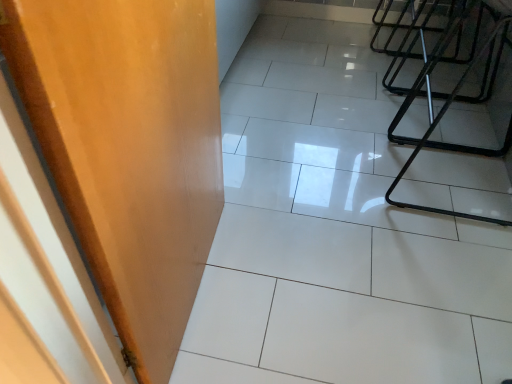
Question: Is wooden door at left at the back of white glossy tile at center?

Choices:
 (A) yes
 (B) no

Answer: (B)

Question: From the image's perspective, is white glossy tile at center located beneath wooden door at left?

Choices:
 (A) no
 (B) yes

Answer: (A)

Question: Does white glossy tile at center appear on the right side of wooden door at left?

Choices:
 (A) no
 (B) yes

Answer: (B)

Question: From a real-world perspective, is white glossy tile at center under wooden door at left?

Choices:
 (A) yes
 (B) no

Answer: (A)

Question: Can you confirm if white glossy tile at center is smaller than wooden door at left?

Choices:
 (A) yes
 (B) no

Answer: (B)

Question: Does white glossy tile at center have a lesser height compared to wooden door at left?

Choices:
 (A) yes
 (B) no

Answer: (A)

Question: Is wooden door at left far away from white glossy tile at center?

Choices:
 (A) no
 (B) yes

Answer: (A)

Question: Does wooden door at left have a lesser width compared to white glossy tile at center?

Choices:
 (A) yes
 (B) no

Answer: (A)

Question: From the image's perspective, is wooden door at left located beneath white glossy tile at center?

Choices:
 (A) no
 (B) yes

Answer: (B)

Question: From a real-world perspective, is wooden door at left on white glossy tile at center?

Choices:
 (A) no
 (B) yes

Answer: (B)

Question: Does wooden door at left have a larger size compared to white glossy tile at center?

Choices:
 (A) no
 (B) yes

Answer: (A)

Question: Is wooden door at left at the left side of white glossy tile at center?

Choices:
 (A) yes
 (B) no

Answer: (A)

Question: From a real-world perspective, is white glossy tile at center above or below wooden door at left?

Choices:
 (A) below
 (B) above

Answer: (A)